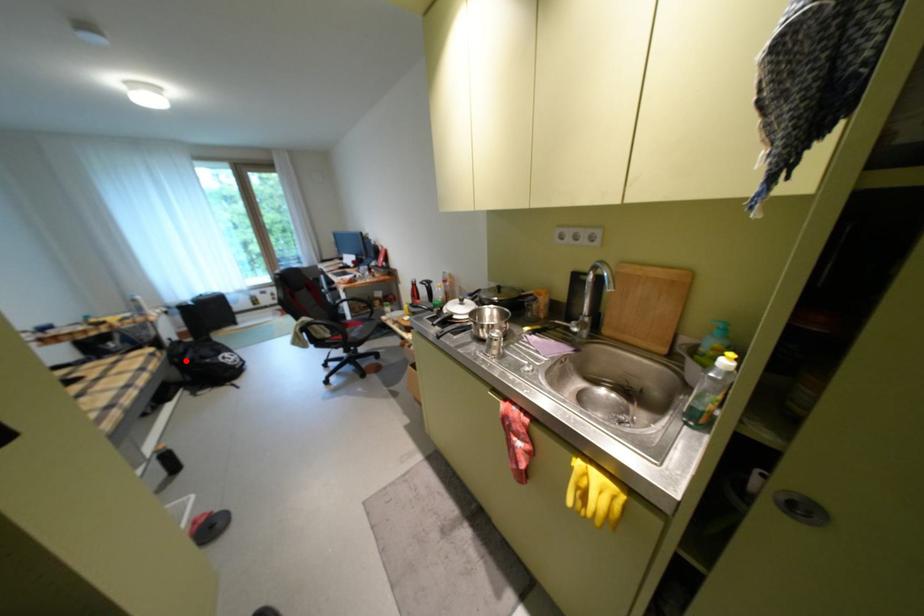
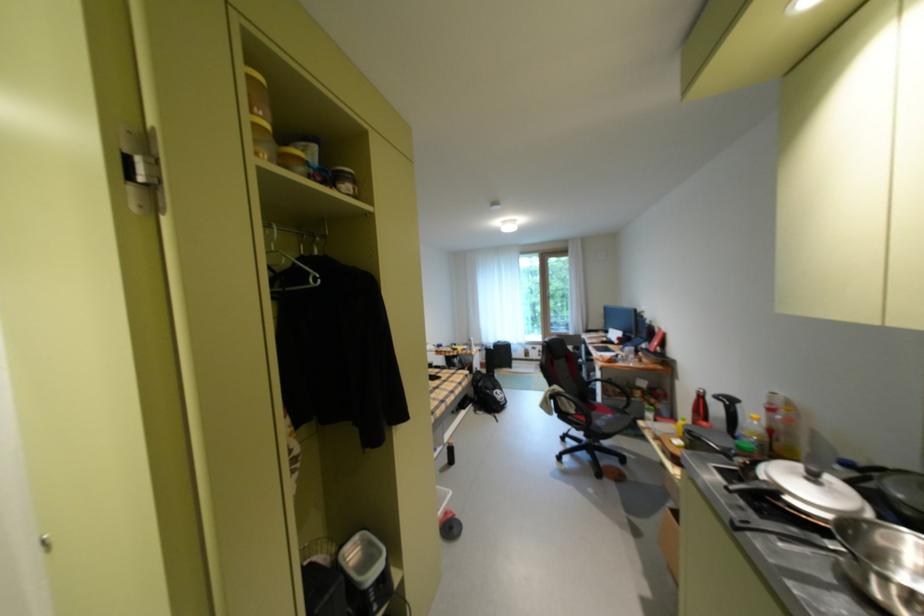
Question: I am providing you with two images of the same scene from different viewpoints. In image1, a red point is highlighted. Considering the same 3D point in image2, which of the following is correct?

Choices:
 (A) It is closer
 (B) It is farther

Answer: (B)